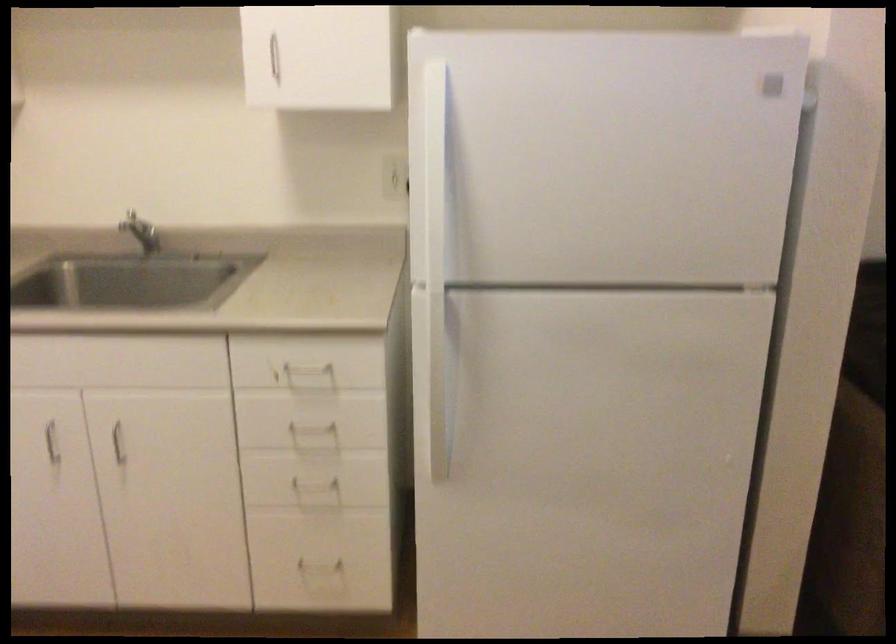
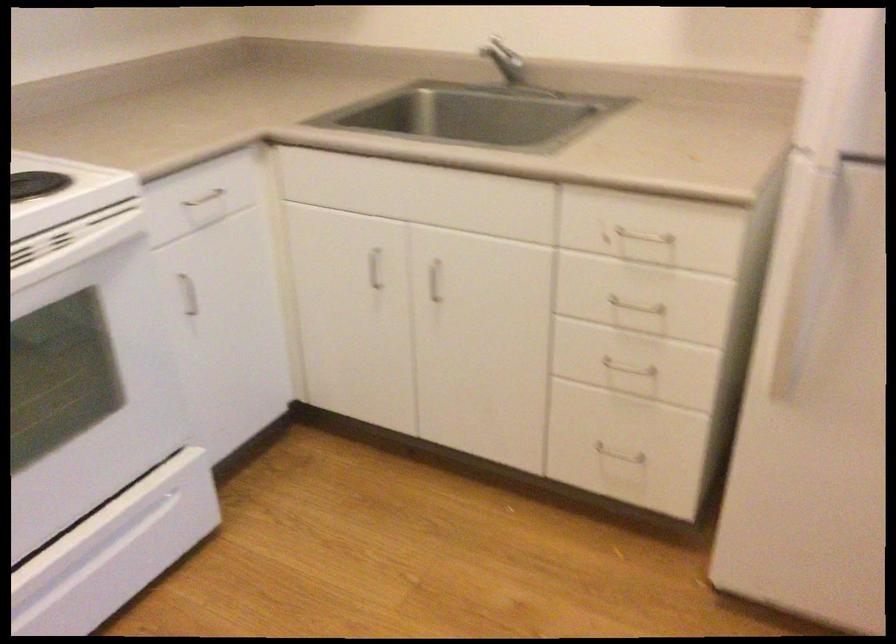
Find the pixel in the second image that matches point (156, 240) in the first image.

(510, 68)